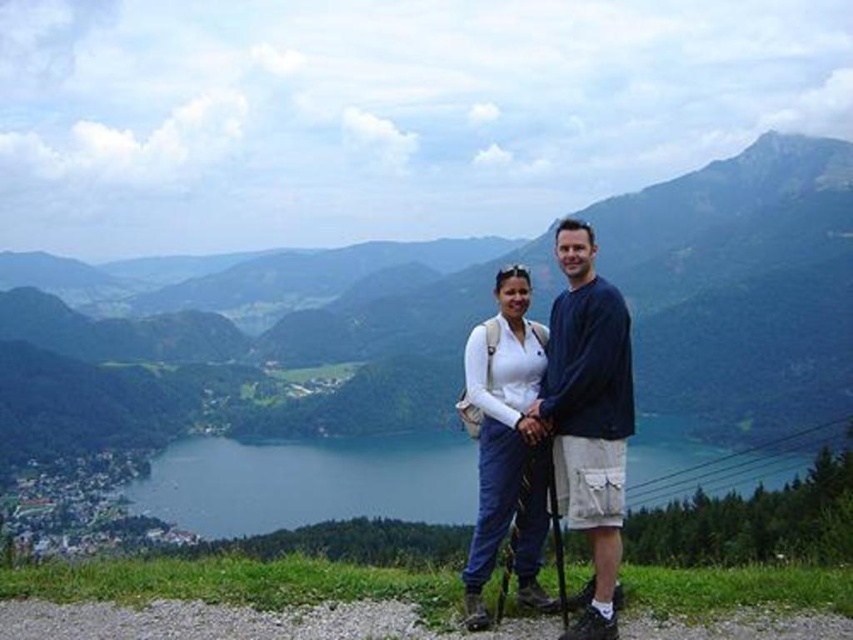
This screenshot has height=640, width=853. I want to click on matte white shirt at center, so click(506, 444).

Between matte white shirt at center and black matte ski pole at lower center, which one appears on the right side from the viewer's perspective?

black matte ski pole at lower center is more to the right.

You are a GUI agent. You are given a task and a screenshot of the screen. Output one action in this format:
    pyautogui.click(x=<x>, y=<y>)
    Task: Click on the matte white shirt at center
    This screenshot has height=640, width=853.
    Given the screenshot: What is the action you would take?
    pyautogui.click(x=506, y=444)

Between point (457, 468) and point (496, 604), which one is positioned in front?

Positioned in front is point (496, 604).

Does blue water at center have a larger size compared to black rubber ski pole at center?

Indeed, blue water at center has a larger size compared to black rubber ski pole at center.

Based on the photo, who is more distant from viewer, (x=374, y=490) or (x=514, y=529)?

The point (x=374, y=490) is more distant.

The width and height of the screenshot is (853, 640). What are the coordinates of `blue water at center` in the screenshot? It's located at (306, 483).

Find the location of a particular element. This screenshot has width=853, height=640. white matte jacket at center is located at coordinates (587, 417).

Is white matte jacket at center bigger than black rubber ski pole at center?

Indeed, white matte jacket at center has a larger size compared to black rubber ski pole at center.

Is point (566, 307) in front of point (525, 477)?

No, (566, 307) is further to viewer.

Locate an element on the screen. This screenshot has width=853, height=640. white matte jacket at center is located at coordinates (587, 417).